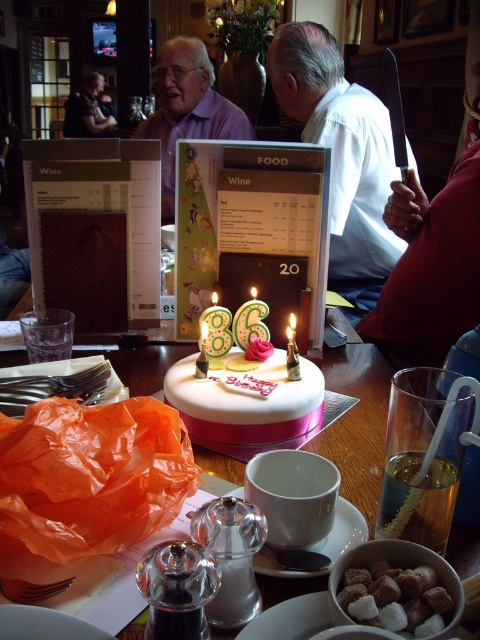
What do you see at coordinates (342, 156) in the screenshot?
I see `white shirt at upper center` at bounding box center [342, 156].

Can you confirm if white shirt at upper center is positioned above smooth skin face at upper left?

Actually, white shirt at upper center is below smooth skin face at upper left.

Is point (379, 116) behind point (100, 115)?

No, it is not.

Identify the location of white shirt at upper center. This screenshot has width=480, height=640. (342, 156).

Does white ceramic cake at center have a lesser width compared to smooth skin face at upper left?

In fact, white ceramic cake at center might be wider than smooth skin face at upper left.

Does point (216, 472) come closer to viewer compared to point (76, 96)?

Yes, point (216, 472) is closer to viewer.

The image size is (480, 640). Identify the location of white ceramic cake at center. (357, 422).

Which is above, white fondant cake at center or matte purple shirt at upper center?

matte purple shirt at upper center is higher up.

Does white fondant cake at center have a greater height compared to matte purple shirt at upper center?

Incorrect, white fondant cake at center's height is not larger of matte purple shirt at upper center's.

The width and height of the screenshot is (480, 640). I want to click on white fondant cake at center, so click(x=245, y=397).

Where is `white fondant cake at center`? The image size is (480, 640). white fondant cake at center is located at coordinates (245, 397).